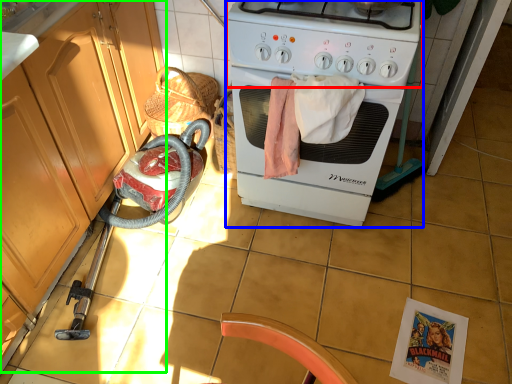
Question: Considering the real-world distances, which object is closest to gas stove (highlighted by a red box)? home appliance (highlighted by a blue box) or cabinetry (highlighted by a green box).

Choices:
 (A) home appliance
 (B) cabinetry

Answer: (A)